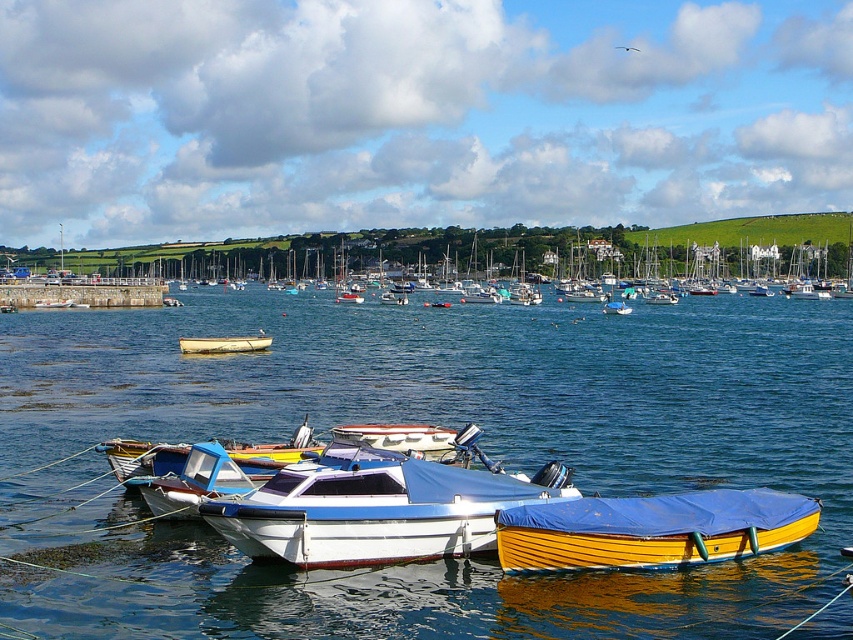
Question: Which object is positioned closest to the yellow wood boat at lower right?

Choices:
 (A) white plastic boat at center
 (B) white glossy motorboat at center
 (C) blue water at center

Answer: (B)

Question: Does blue water at center have a lesser width compared to yellow wood boat at lower right?

Choices:
 (A) no
 (B) yes

Answer: (A)

Question: Does blue water at center have a lesser width compared to white glossy motorboat at center?

Choices:
 (A) yes
 (B) no

Answer: (B)

Question: Is blue water at center positioned at the back of white plastic boat at center?

Choices:
 (A) no
 (B) yes

Answer: (A)

Question: Which object appears farthest from the camera in this image?

Choices:
 (A) white plastic boat at center
 (B) blue water at center
 (C) yellow wood boat at lower right

Answer: (A)

Question: Which of the following is the closest to the observer?

Choices:
 (A) (289, 467)
 (B) (636, 529)

Answer: (B)